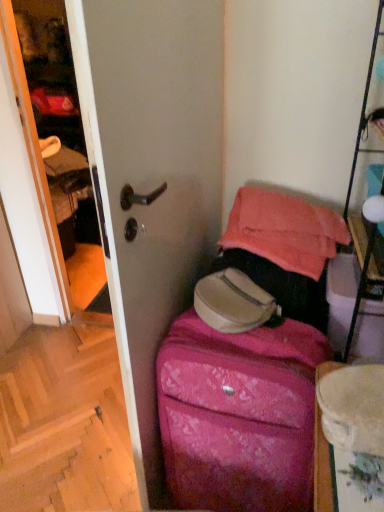
Question: Considering the relative positions of pink textured suitcase at center and wooden at lower left in the image provided, is pink textured suitcase at center to the right of wooden at lower left from the viewer's perspective?

Choices:
 (A) yes
 (B) no

Answer: (A)

Question: Is pink textured suitcase at center in contact with wooden at lower left?

Choices:
 (A) yes
 (B) no

Answer: (B)

Question: Does pink textured suitcase at center lie in front of wooden at lower left?

Choices:
 (A) no
 (B) yes

Answer: (B)

Question: Does pink textured suitcase at center have a greater width compared to wooden at lower left?

Choices:
 (A) yes
 (B) no

Answer: (B)

Question: Is pink textured suitcase at center bigger than wooden at lower left?

Choices:
 (A) no
 (B) yes

Answer: (B)

Question: Considering the positions of point (24, 467) and point (193, 81), is point (24, 467) closer or farther from the camera than point (193, 81)?

Choices:
 (A) farther
 (B) closer

Answer: (A)

Question: Considering the positions of wooden at lower left and pink fabric suitcase at lower right in the image, is wooden at lower left taller or shorter than pink fabric suitcase at lower right?

Choices:
 (A) tall
 (B) short

Answer: (B)

Question: Considering their positions, is wooden at lower left located in front of or behind pink fabric suitcase at lower right?

Choices:
 (A) front
 (B) behind

Answer: (B)

Question: Is wooden at lower left bigger or smaller than pink fabric suitcase at lower right?

Choices:
 (A) big
 (B) small

Answer: (B)

Question: Is pink fabric suitcase at lower right spatially inside wooden at lower left, or outside of it?

Choices:
 (A) outside
 (B) inside

Answer: (A)

Question: Considering the positions of pink fabric suitcase at lower right and wooden at lower left in the image, is pink fabric suitcase at lower right taller or shorter than wooden at lower left?

Choices:
 (A) short
 (B) tall

Answer: (B)

Question: Relative to wooden at lower left, is pink fabric suitcase at lower right in front or behind?

Choices:
 (A) behind
 (B) front

Answer: (B)

Question: Considering the relative positions of pink fabric suitcase at lower right and wooden at lower left in the image provided, is pink fabric suitcase at lower right to the left or to the right of wooden at lower left?

Choices:
 (A) left
 (B) right

Answer: (B)

Question: Is wooden at lower left spatially inside pink textured suitcase at center, or outside of it?

Choices:
 (A) inside
 (B) outside

Answer: (B)

Question: From their relative heights in the image, would you say wooden at lower left is taller or shorter than pink textured suitcase at center?

Choices:
 (A) short
 (B) tall

Answer: (A)